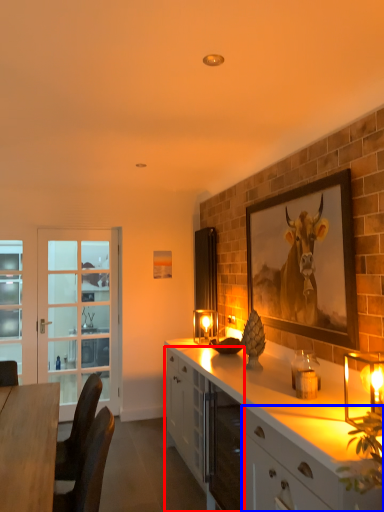
Question: Among these objects, which one is nearest to the camera, cabinetry (highlighted by a red box) or cabinetry (highlighted by a blue box)?

Choices:
 (A) cabinetry
 (B) cabinetry

Answer: (B)